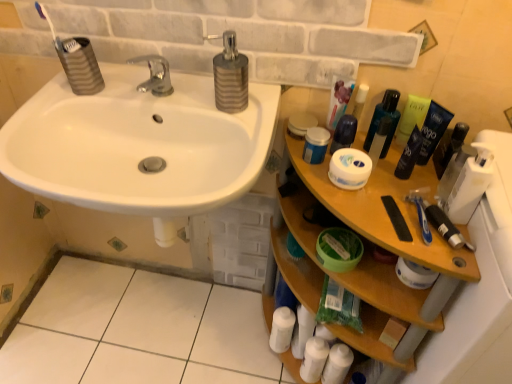
The width and height of the screenshot is (512, 384). Identify the location of vacant position to the left of dark blue plastic mouthwash at upper right, acting as the fourth mouthwash starting from the left. (349, 195).